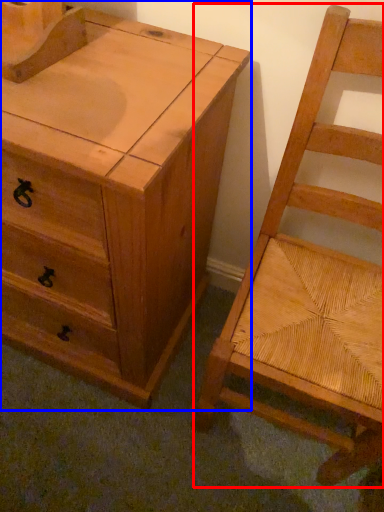
Question: Which object appears farthest to the camera in this image, chair (highlighted by a red box) or chest of drawers (highlighted by a blue box)?

Choices:
 (A) chair
 (B) chest of drawers

Answer: (B)